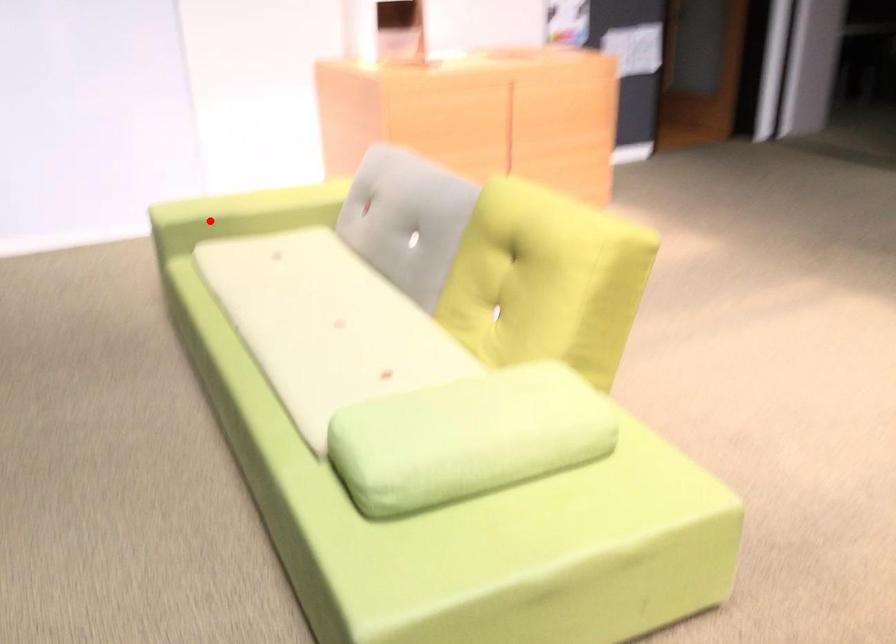
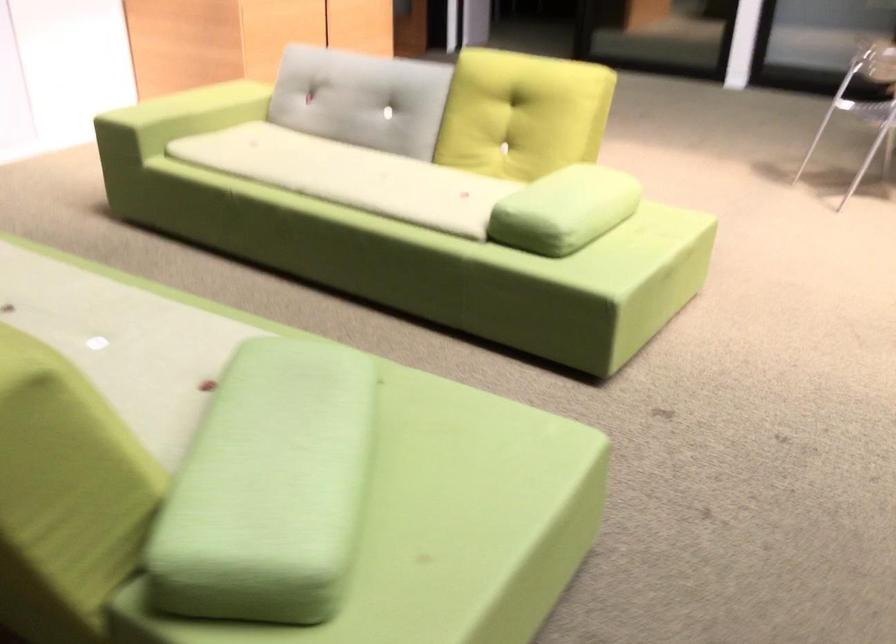
Find the pixel in the second image that matches the highlighted location in the first image.

(178, 117)